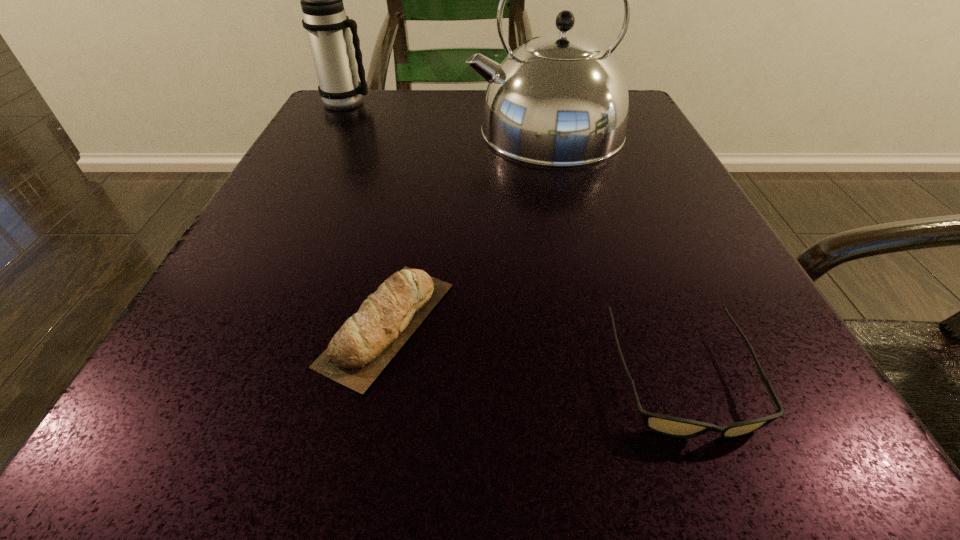
I want to click on kettle, so click(x=559, y=100).

Locate an element on the screen. The height and width of the screenshot is (540, 960). the second tallest object is located at coordinates (324, 18).

Find the location of a particular element. Image resolution: width=960 pixels, height=540 pixels. the leftmost object is located at coordinates click(324, 18).

Image resolution: width=960 pixels, height=540 pixels. Find the location of `the second object from left to right`. the second object from left to right is located at coordinates (365, 344).

The image size is (960, 540). Find the location of `sunglasses`. sunglasses is located at coordinates click(x=671, y=426).

I want to click on free region located from the spout of the tallest object, so click(x=372, y=131).

You are a GUI agent. You are given a task and a screenshot of the screen. Output one action in this format:
    pyautogui.click(x=<x>, y=<y>)
    Task: Click on the vacant space located 0.190m from the spout of the tallest object
    
    Given the screenshot: What is the action you would take?
    pyautogui.click(x=367, y=131)

Find the location of a particular element. The image size is (960, 540). free space located from the spout of the tallest object is located at coordinates (377, 131).

At what (x,y) coordinates should I click in order to perform the action: click on free space located on the side with the handle of the leftmost object. Please return your answer as a coordinate pair (x, y). The image size is (960, 540). Looking at the image, I should click on (422, 103).

In order to click on free space located on the right of the second object from left to right in this screenshot , I will do `click(691, 323)`.